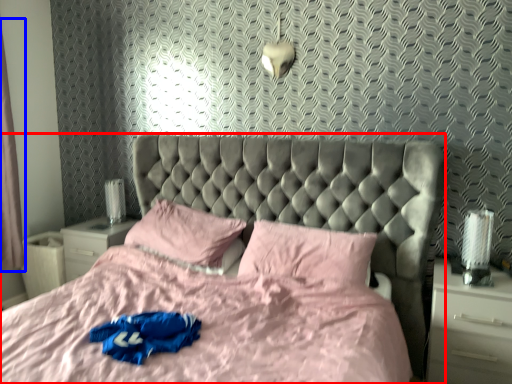
Question: Which of the following is the farthest to the observer, bed (highlighted by a red box) or curtain (highlighted by a blue box)?

Choices:
 (A) bed
 (B) curtain

Answer: (B)